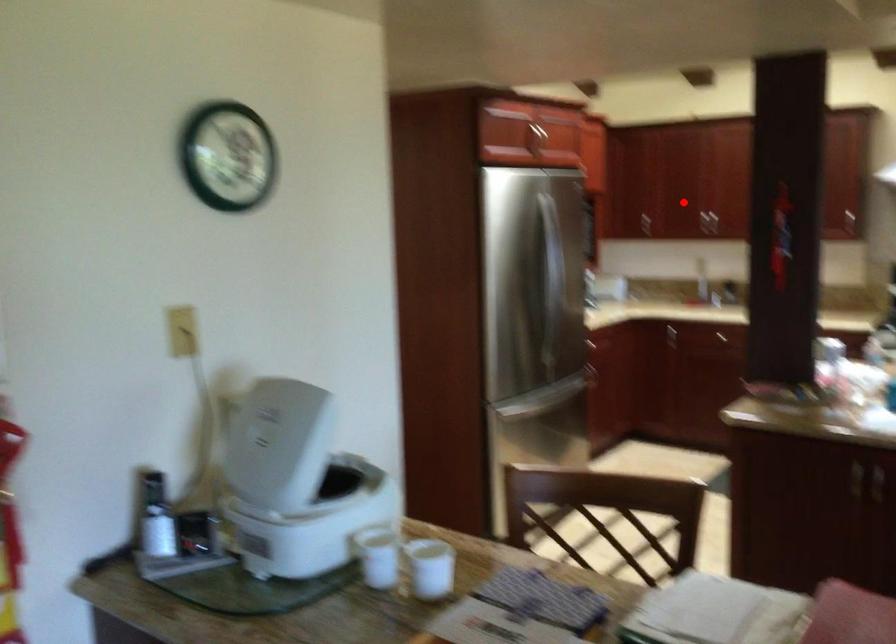
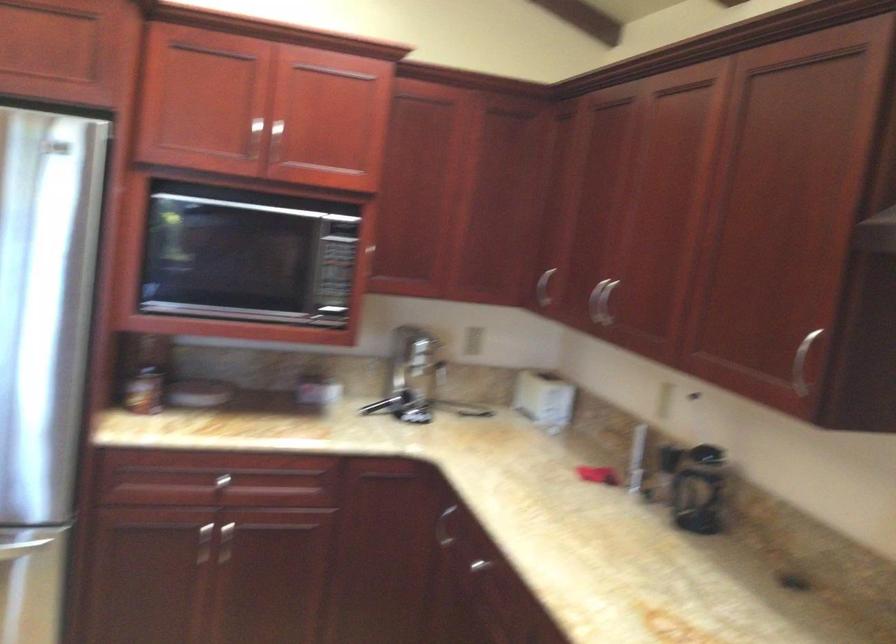
Find the pixel in the second image that matches the highlighted location in the first image.

(600, 301)